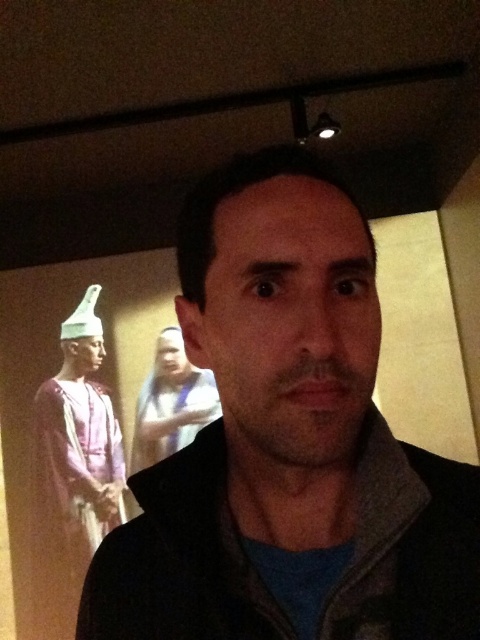
Based on the photo, you are a photographer setting up for a photoshoot in the museum. You have a matte purple fabric at left and a smooth beige scarf at center. Which object is positioned to the right side of the other?

The smooth beige scarf at center is to the right of the matte purple fabric at left.

You are a photographer setting up for a shoot in this room. You need to place a small tripod between the matte purple fabric at left and the smooth beige scarf at center. Which object should the tripod be closer to to ensure it is placed in front of both?

The matte purple fabric at left is closer to the photographer since it is further to the viewer than the smooth beige scarf at center. Therefore, placing the tripod closer to the matte purple fabric at left will ensure it is in front of both objects.